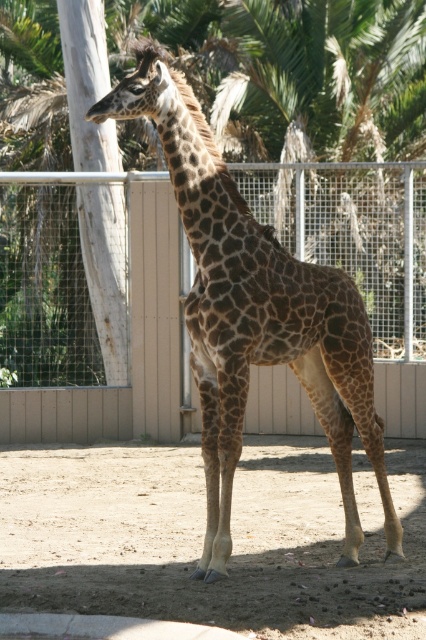
You are a zookeeper planning to place a new feeding trough for the giraffe. The trough requires a space wider than the brown sandy dirt at center. Can the metal mesh fence at center provide enough width for the trough? Please explain.

The brown sandy dirt at center is narrower than the metal mesh fence at center. Since the trough needs a space wider than the brown sandy dirt at center, the metal mesh fence at center can provide sufficient width for the trough because it is wider than the sandy dirt area.

You are standing in front of a zoo enclosure with a giraffe. The brown sandy dirt at center is the ground where the giraffe is standing. If you want to measure the distance from where you are standing to the ground under the giraffe, what would that distance be?

The distance between you and the brown sandy dirt at center is 7.70 meters.

You are a zookeeper who needs to clean the enclosure. You see the brown sandy dirt at center and the metal mesh fence at center. Which object is lower in height from the ground?

A: The brown sandy dirt at center is located below the metal mesh fence at center, so the brown sandy dirt at center is lower in height from the ground.